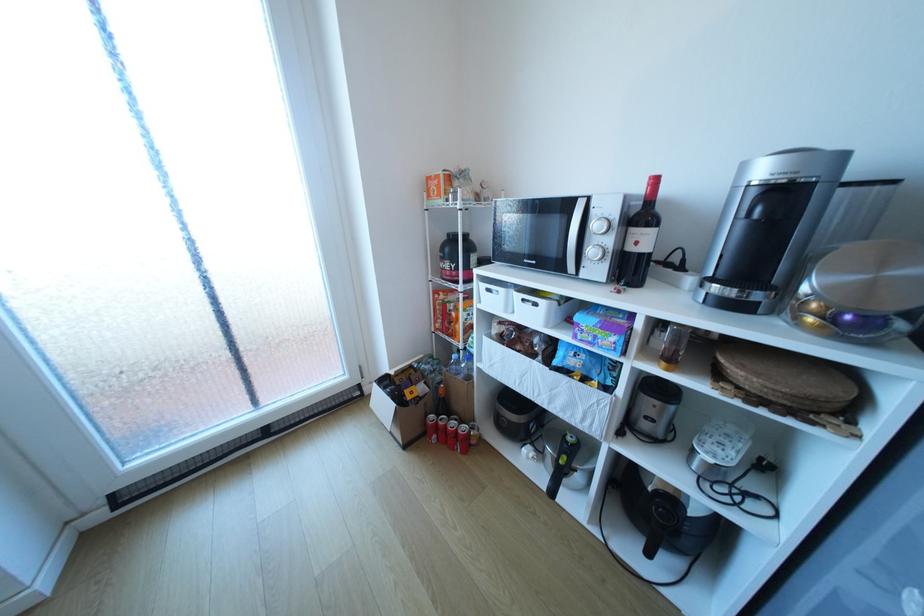
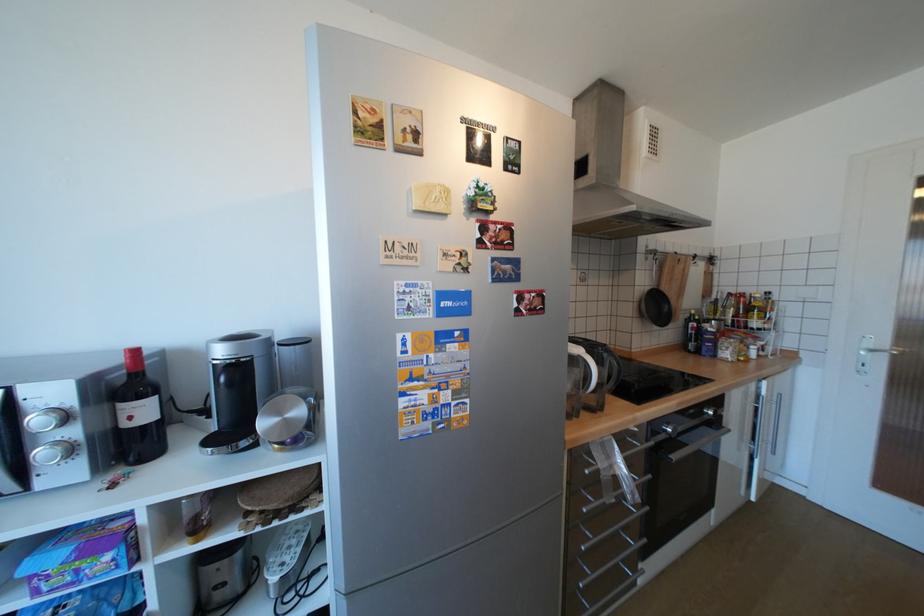
Where in the second image is the point corresponding to (x=646, y=243) from the first image?

(140, 418)